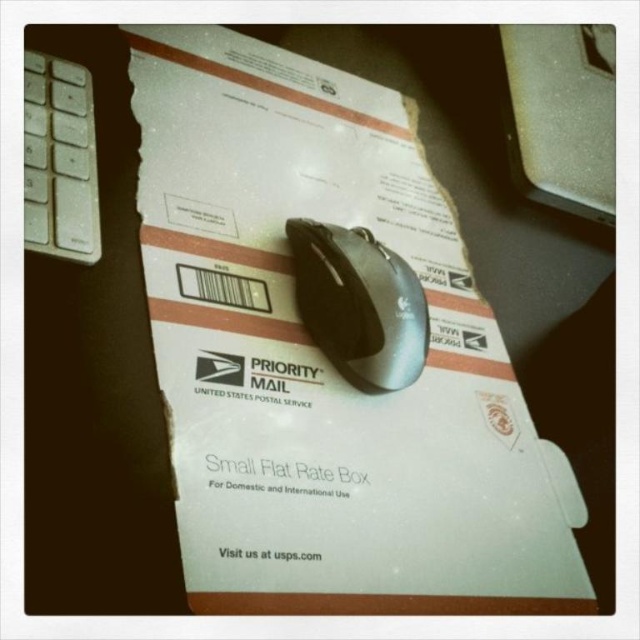
Based on the photo, you need to pack the satin black mouse at center and the white plastic keyboard at left into the USPS box shown. Based on their sizes, which item should you place first into the box to ensure both fit properly?

The satin black mouse at center is smaller than the white plastic keyboard at left, so you should place the white plastic keyboard at left first to ensure both items fit properly.

You are trying to decide whether to place a new accessory on top of the metallic silver computer at upper right or the satin black mouse at center. Based on their sizes, which object would be more stable to place it on?

The metallic silver computer at upper right is larger in size than the satin black mouse at center, so placing the accessory on the metallic silver computer at upper right would provide a more stable surface.

You are packing a metallic silver computer at upper right into a USPS Priority Mail Small Flat Rate Box. The box has a maximum weight capacity of 20 pounds. If the computer weighs 18 pounds, will it fit inside the box?

The metallic silver computer at upper right is 72.92 centimeters away from the box, so it cannot be placed inside the box as it is outside the box.